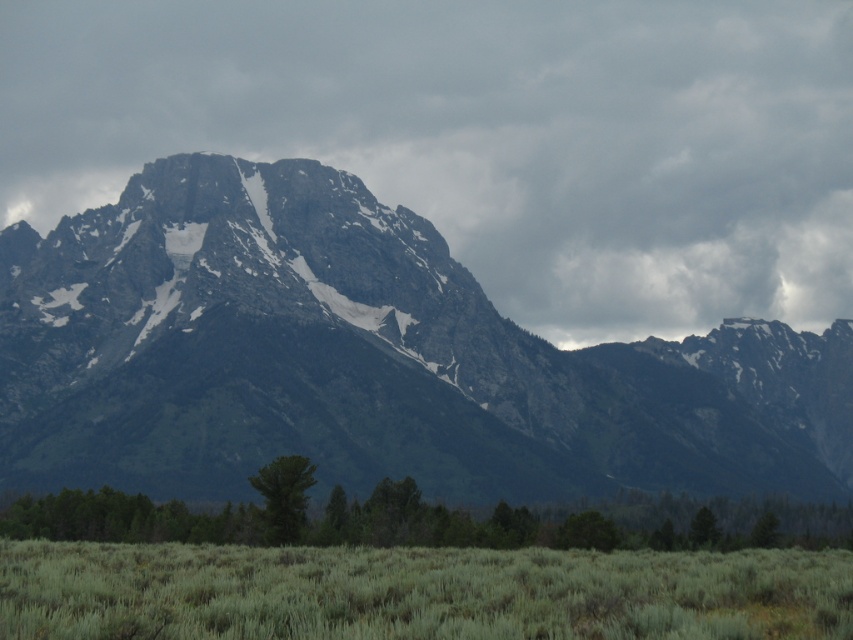
Which is behind, point (264, 552) or point (279, 513)?

Positioned behind is point (279, 513).

Consider the image. Is green grassy field at lower center to the left of green leafy tree at lower center from the viewer's perspective?

No, green grassy field at lower center is not to the left of green leafy tree at lower center.

Find the location of `green grassy field at lower center`. green grassy field at lower center is located at coordinates (416, 593).

Who is shorter, gray rock mountain range at center or green leafy tree at lower center?

green leafy tree at lower center

Does point (413, 476) come closer to viewer compared to point (292, 481)?

No, it is behind (292, 481).

Locate an element on the screen. The width and height of the screenshot is (853, 640). gray rock mountain range at center is located at coordinates (364, 358).

From the picture: Who is positioned more to the left, gray rock mountain at center or green matte tree at center?

From the viewer's perspective, green matte tree at center appears more on the left side.

Does gray rock mountain at center have a larger size compared to green matte tree at center?

Indeed, gray rock mountain at center has a larger size compared to green matte tree at center.

Is point (334, 116) positioned behind point (302, 484)?

Yes.

Where is `gray rock mountain at center`? This screenshot has height=640, width=853. gray rock mountain at center is located at coordinates (485, 138).